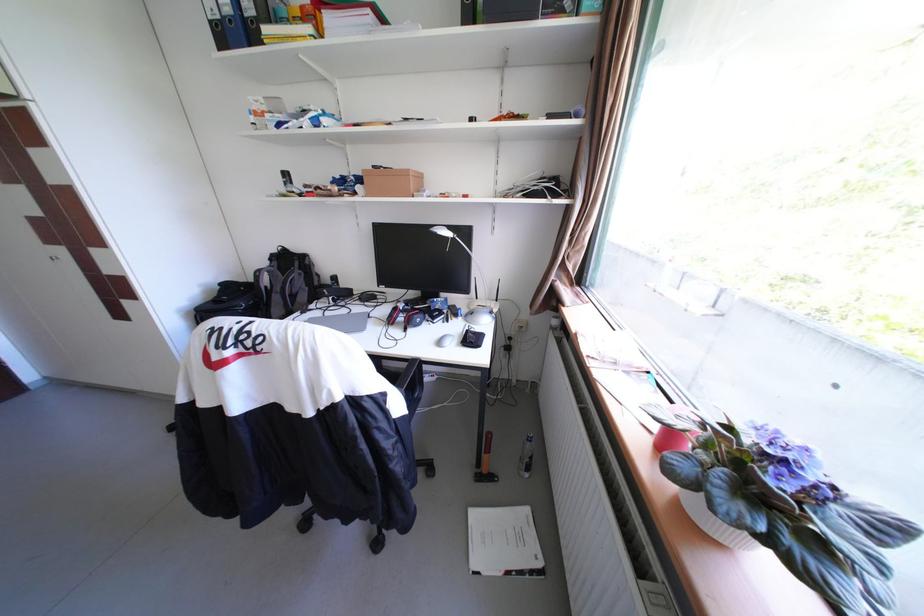
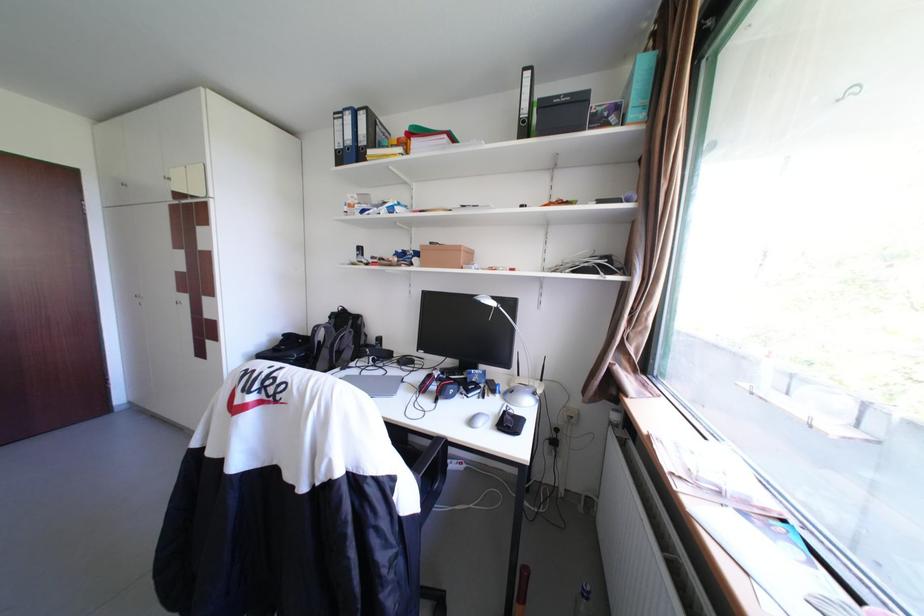
In the second image, find the point that corresponds to [450,342] in the first image.

(481, 422)